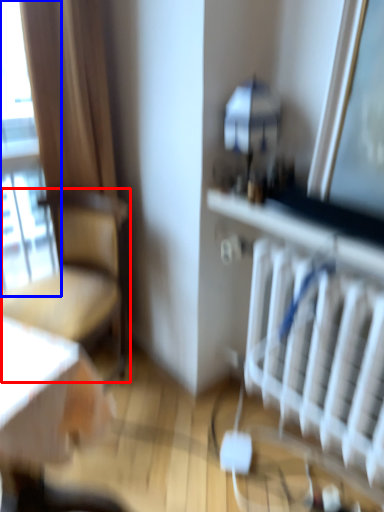
Question: Which object is further to the camera taking this photo, chair (highlighted by a red box) or window (highlighted by a blue box)?

Choices:
 (A) chair
 (B) window

Answer: (B)